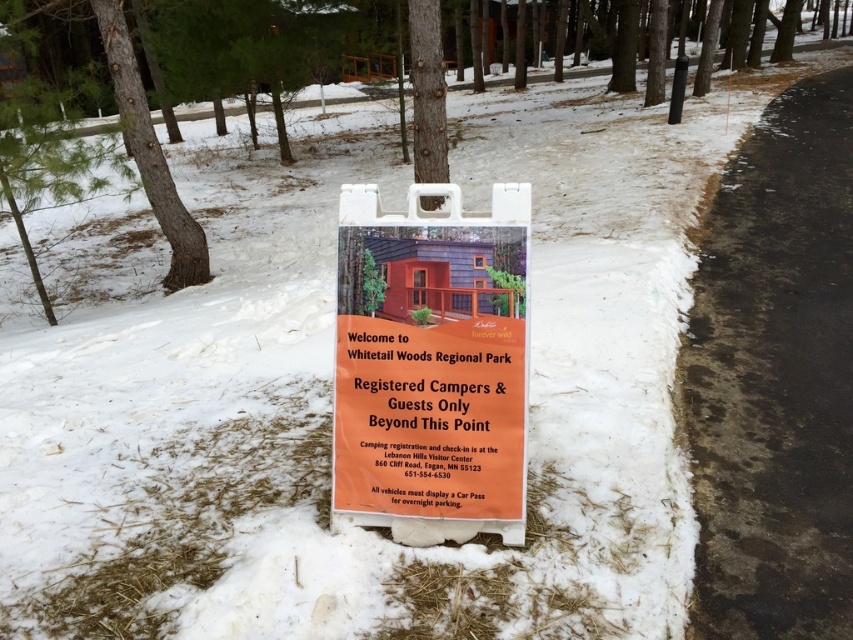
Looking at this image, you are a hiker who just arrived at Whitetail Woods Regional Park. You see the orange paper sign at center and the smooth brown bark at left. According to the spatial arrangement, which object is positioned to the right of the other?

The orange paper sign at center is to the right of smooth brown bark at left.

What is located at the point with coordinates (431, 365) in the image?

The orange paper sign at center is located at point (431, 365).